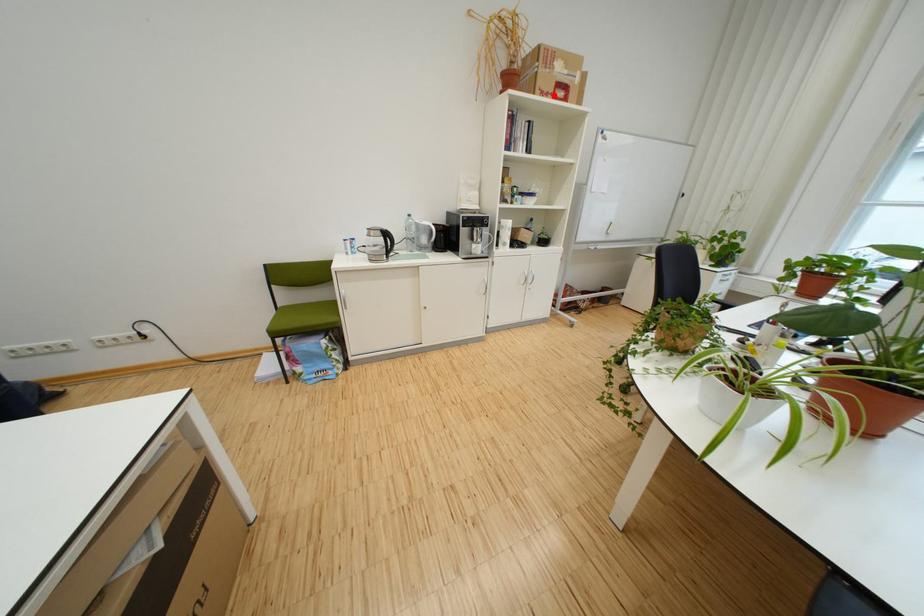
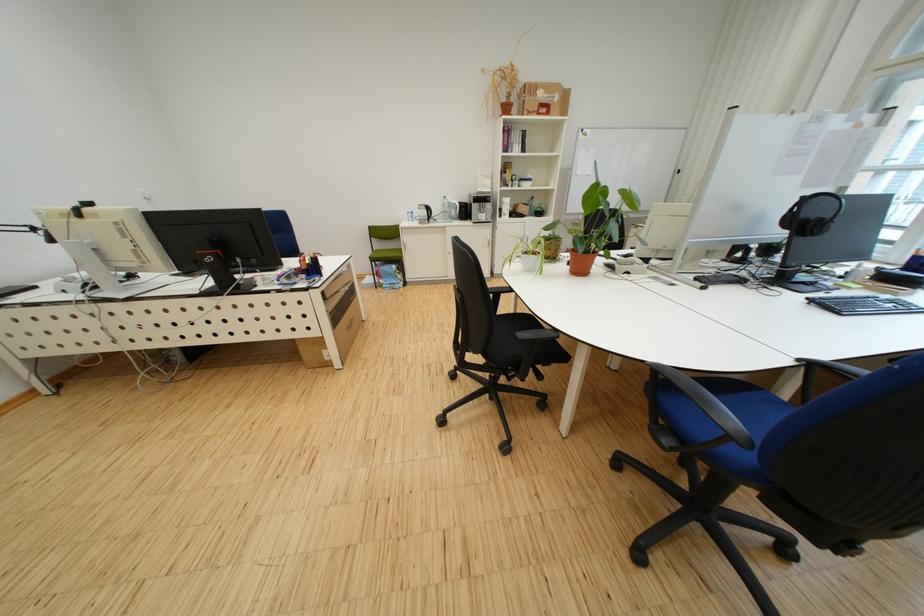
The point at the highlighted location is marked in the first image. Where is the corresponding point in the second image?

(541, 115)